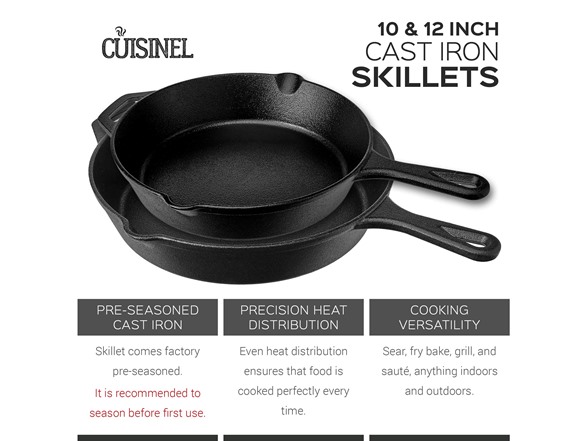
This screenshot has height=441, width=588. Find the location of `surface`. surface is located at coordinates (277, 168), (343, 223).